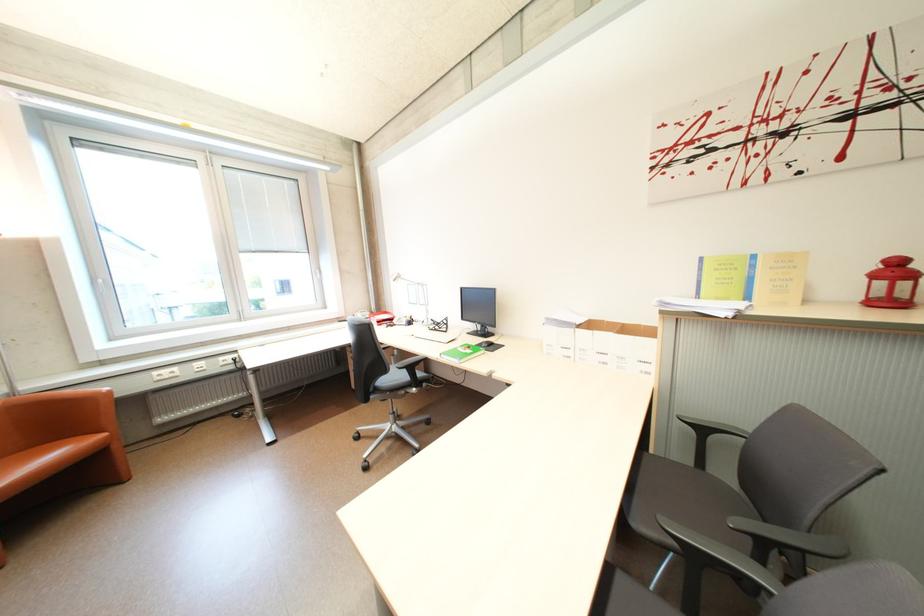
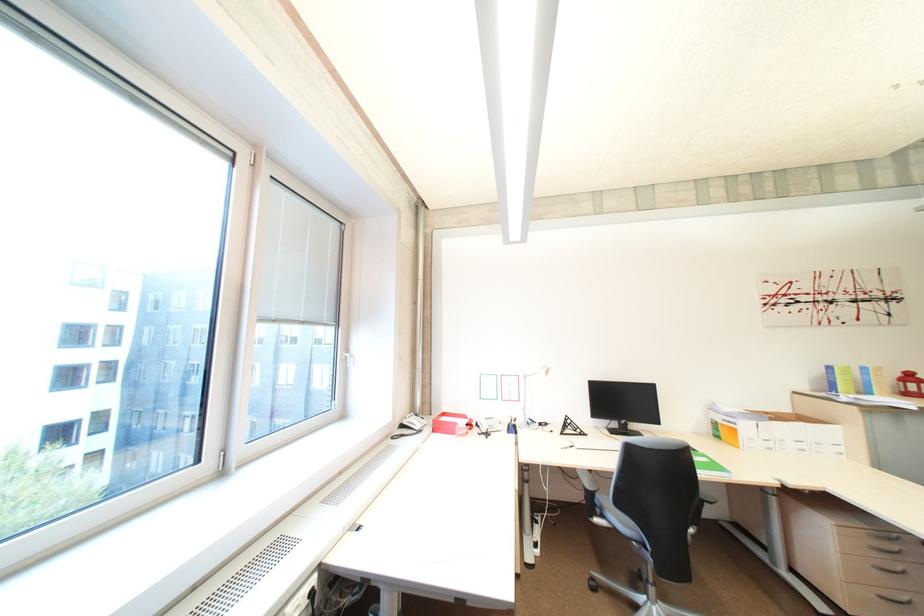
The point at (x=882, y=277) is marked in the first image. Where is the corresponding point in the second image?

(913, 382)